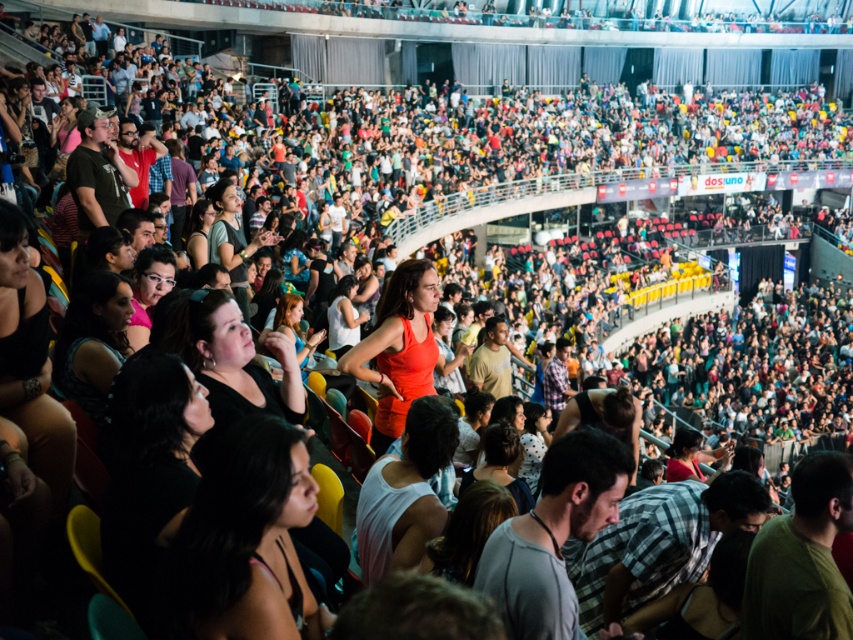
Question: Which is farther from the dark hair at lower center?

Choices:
 (A) white matte tank top at center
 (B) matte orange dress at center

Answer: (B)

Question: Which object appears closest to the camera in this image?

Choices:
 (A) gray cotton shirt at center
 (B) dark hair at lower center
 (C) white matte tank top at center
 (D) dark green t-shirt at center

Answer: (B)

Question: Does dark hair at lower center appear over matte orange dress at center?

Choices:
 (A) no
 (B) yes

Answer: (A)

Question: Is dark hair at lower center above dark green t-shirt at center?

Choices:
 (A) yes
 (B) no

Answer: (A)

Question: Which point is farther from the camera taking this photo?

Choices:
 (A) (624, 477)
 (B) (363, 348)

Answer: (B)

Question: Does dark hair at lower center lie behind white matte tank top at center?

Choices:
 (A) no
 (B) yes

Answer: (A)